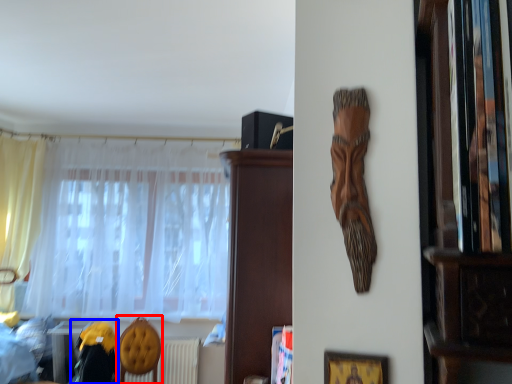
Question: Which of the following is the farthest to the observer, armchair (highlighted by a red box) or swivel chair (highlighted by a blue box)?

Choices:
 (A) armchair
 (B) swivel chair

Answer: (A)